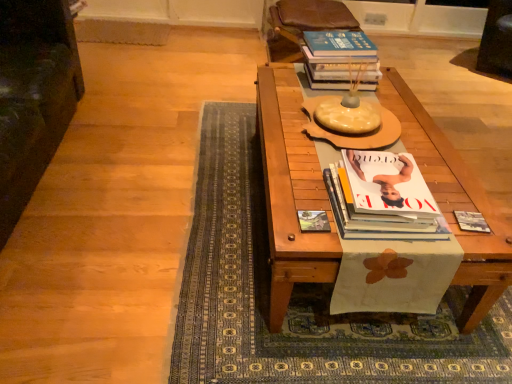
The width and height of the screenshot is (512, 384). Find the location of `empty space that is in between dark green fabric armchair at left, placed as the first armchair when sorted from front to back, and brown leather armchair at upper center, the 2th armchair when ordered from left to right`. empty space that is in between dark green fabric armchair at left, placed as the first armchair when sorted from front to back, and brown leather armchair at upper center, the 2th armchair when ordered from left to right is located at coordinates (156, 132).